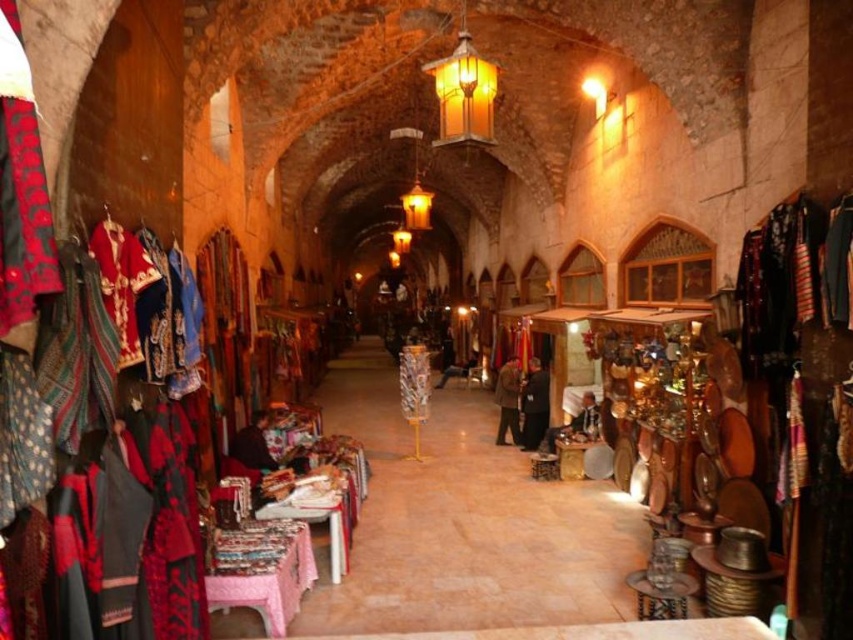
Question: Can you confirm if black fabric at center is positioned below brown wool coat at center?

Choices:
 (A) no
 (B) yes

Answer: (A)

Question: Does black fabric at center come in front of brown wool coat at center?

Choices:
 (A) no
 (B) yes

Answer: (B)

Question: Is black fabric at center bigger than brown wool coat at center?

Choices:
 (A) yes
 (B) no

Answer: (B)